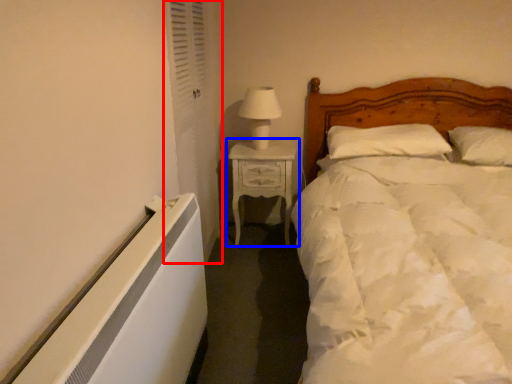
Question: Which object appears farthest to the camera in this image, curtain (highlighted by a red box) or nightstand (highlighted by a blue box)?

Choices:
 (A) curtain
 (B) nightstand

Answer: (B)